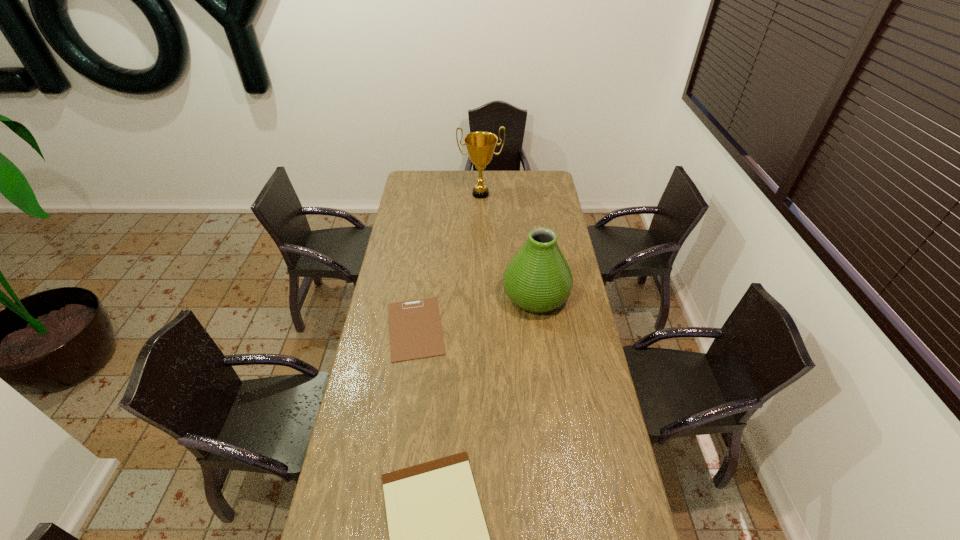
What are the coordinates of `free space at the far edge of the desktop` in the screenshot? It's located at (505, 172).

Where is `blank space at the left edge of the desktop`? blank space at the left edge of the desktop is located at coordinates pos(418,223).

Image resolution: width=960 pixels, height=540 pixels. In order to click on free space at the right edge of the desktop in this screenshot , I will do `click(576, 353)`.

Where is `free space between the farther clipboard and the farthest object`? This screenshot has width=960, height=540. free space between the farther clipboard and the farthest object is located at coordinates (448, 261).

Identify the location of free space between the farther clipboard and the third shortest object. (476, 312).

The image size is (960, 540). I want to click on vacant region between the farthest object and the farther clipboard, so click(x=448, y=261).

This screenshot has width=960, height=540. What are the coordinates of `blank region between the farther clipboard and the vase` in the screenshot? It's located at (476, 312).

Where is `free space between the farther clipboard and the vase`? free space between the farther clipboard and the vase is located at coordinates (476, 312).

This screenshot has width=960, height=540. I want to click on blank region between the farthest object and the farther clipboard, so click(x=448, y=261).

Locate an element on the screen. Image resolution: width=960 pixels, height=540 pixels. free space between the farther clipboard and the award is located at coordinates point(448,261).